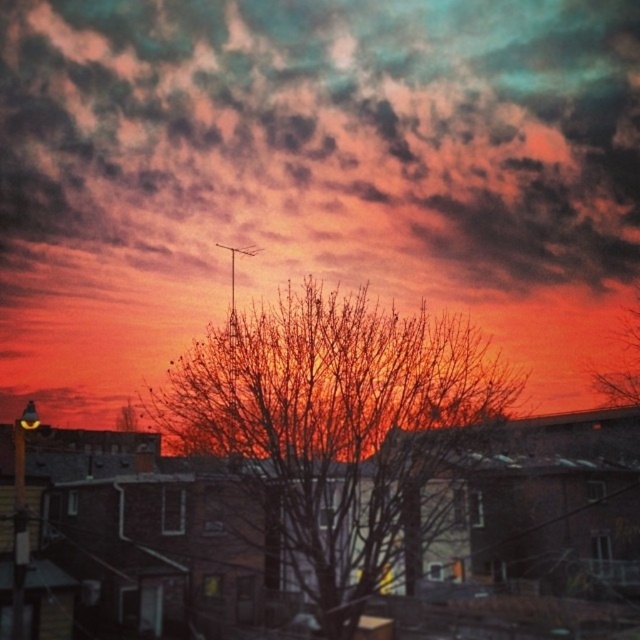
You are an astronomer observing the sunset scene. You notice the cloudy sky at upper center and the bare branches at center. Which object is positioned higher in the sky?

The cloudy sky at upper center is positioned higher in the sky than the bare branches at center.

You are a drone operator who needs to fly a drone between two points marked as point (54,3). Can you safely navigate the drone through this distance?

The two points marked as point (54,3) are 42.02 meters apart, so yes, the drone can safely navigate through this distance as it is a sufficient distance for flight.

You are standing in the residential area depicted in the image. You want to estimate how far the cloudy sky at upper center is from you. Can you determine its distance based on the information provided?

The cloudy sky at upper center is 123.75 feet away from the viewer.